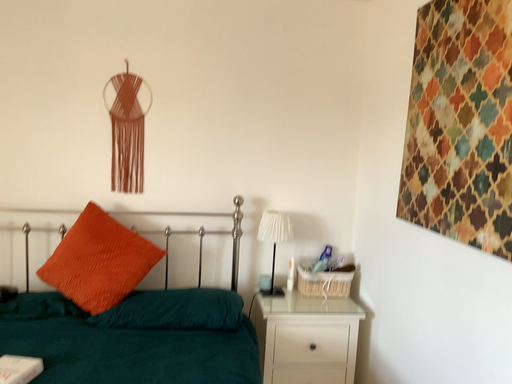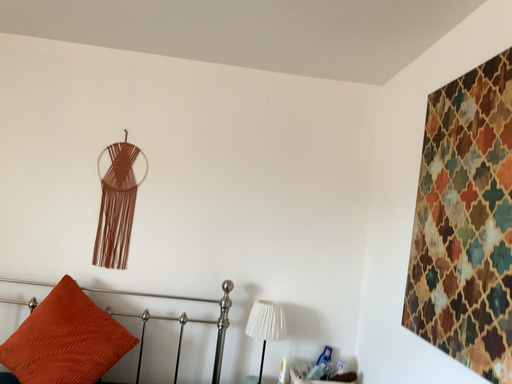
Question: Which way did the camera rotate in the video?

Choices:
 (A) rotated downward
 (B) rotated upward

Answer: (B)